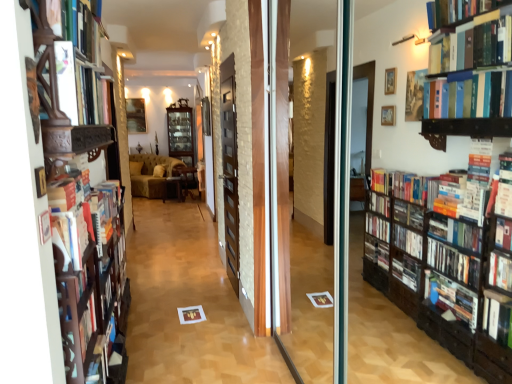
I want to click on free space between wooden bookshelf at left and dark brown wooden screen door at center, so click(183, 328).